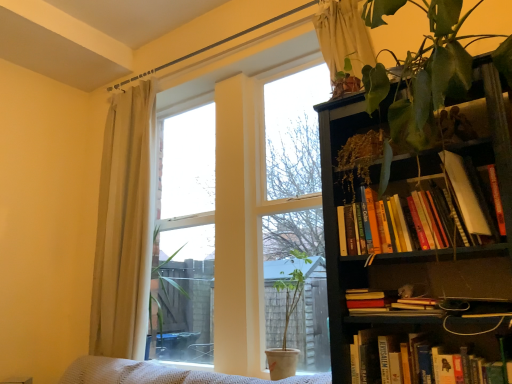
At what (x,y) coordinates should I click in order to perform the action: click on empty space that is ontop of hardcover books at upper right, the second book positioned from the bottom (from a real-world perspective). Please return your answer as a coordinate pair (x, y). The image size is (512, 384). Looking at the image, I should click on (418, 162).